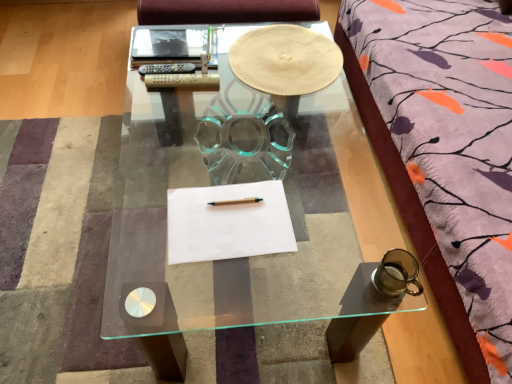
Identify the location of free location to the left of wooden pencil at center. (191, 207).